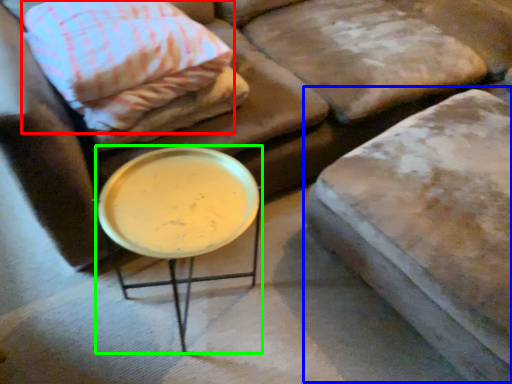
Question: Which is farther away from pillow (highlighted by a red box)? swivel chair (highlighted by a blue box) or table (highlighted by a green box)?

Choices:
 (A) swivel chair
 (B) table

Answer: (A)